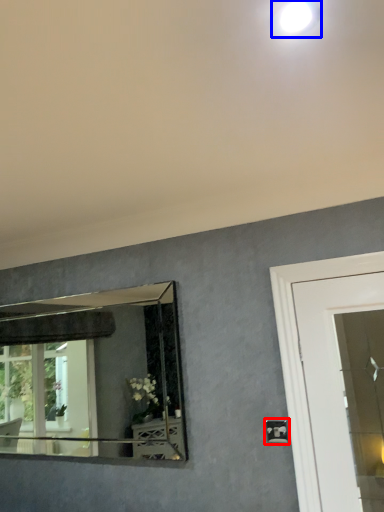
Question: Which object is closer to the camera taking this photo, light switch (highlighted by a red box) or droplight (highlighted by a blue box)?

Choices:
 (A) light switch
 (B) droplight

Answer: (B)